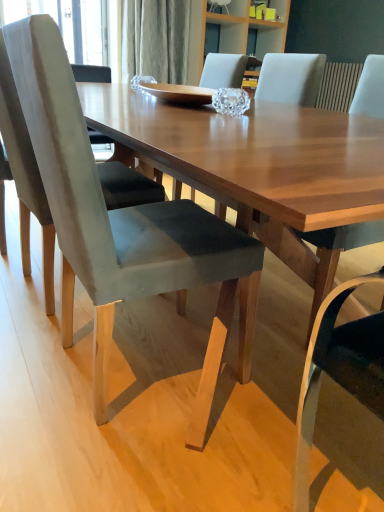
Question: Is suede gray chair at left, positioned as the first chair in left-to-right order, far away from matte gray chair at center, which is the first chair in right-to-left order?

Choices:
 (A) no
 (B) yes

Answer: (A)

Question: Can you confirm if suede gray chair at left, positioned as the first chair in left-to-right order, is shorter than matte gray chair at center, which is the first chair in right-to-left order?

Choices:
 (A) no
 (B) yes

Answer: (A)

Question: Is suede gray chair at left, positioned as the first chair in left-to-right order, located outside matte gray chair at center, which is the first chair in right-to-left order?

Choices:
 (A) yes
 (B) no

Answer: (A)

Question: Is suede gray chair at left, positioned as the first chair in left-to-right order, positioned behind matte gray chair at center, the third chair when ordered from left to right?

Choices:
 (A) yes
 (B) no

Answer: (A)

Question: From the image's perspective, is suede gray chair at left, positioned as the first chair in left-to-right order, under matte gray chair at center, the third chair when ordered from left to right?

Choices:
 (A) yes
 (B) no

Answer: (B)

Question: Is suede gray chair at left, positioned as the first chair in left-to-right order, thinner than matte gray chair at center, the third chair when ordered from left to right?

Choices:
 (A) no
 (B) yes

Answer: (A)

Question: From the image's perspective, is velvet gray chair at center, marked as the 2th chair in a right-to-left arrangement, under suede gray chair at left, the 3th chair from the right?

Choices:
 (A) yes
 (B) no

Answer: (A)

Question: Is velvet gray chair at center, positioned as the 2th chair in left-to-right order, taller than suede gray chair at left, the 3th chair from the right?

Choices:
 (A) no
 (B) yes

Answer: (A)

Question: Is suede gray chair at left, the 3th chair from the right, completely or partially inside velvet gray chair at center, marked as the 2th chair in a right-to-left arrangement?

Choices:
 (A) yes
 (B) no

Answer: (B)

Question: Is velvet gray chair at center, marked as the 2th chair in a right-to-left arrangement, to the right of suede gray chair at left, positioned as the first chair in left-to-right order, from the viewer's perspective?

Choices:
 (A) yes
 (B) no

Answer: (A)

Question: Considering the relative sizes of velvet gray chair at center, marked as the 2th chair in a right-to-left arrangement, and suede gray chair at left, positioned as the first chair in left-to-right order, in the image provided, is velvet gray chair at center, marked as the 2th chair in a right-to-left arrangement, thinner than suede gray chair at left, positioned as the first chair in left-to-right order,?

Choices:
 (A) yes
 (B) no

Answer: (A)

Question: Is there a large distance between velvet gray chair at center, positioned as the 2th chair in left-to-right order, and suede gray chair at left, positioned as the first chair in left-to-right order?

Choices:
 (A) no
 (B) yes

Answer: (A)

Question: Is matte gray chair at center, the third chair when ordered from left to right, smaller than suede gray chair at left, positioned as the first chair in left-to-right order?

Choices:
 (A) yes
 (B) no

Answer: (A)